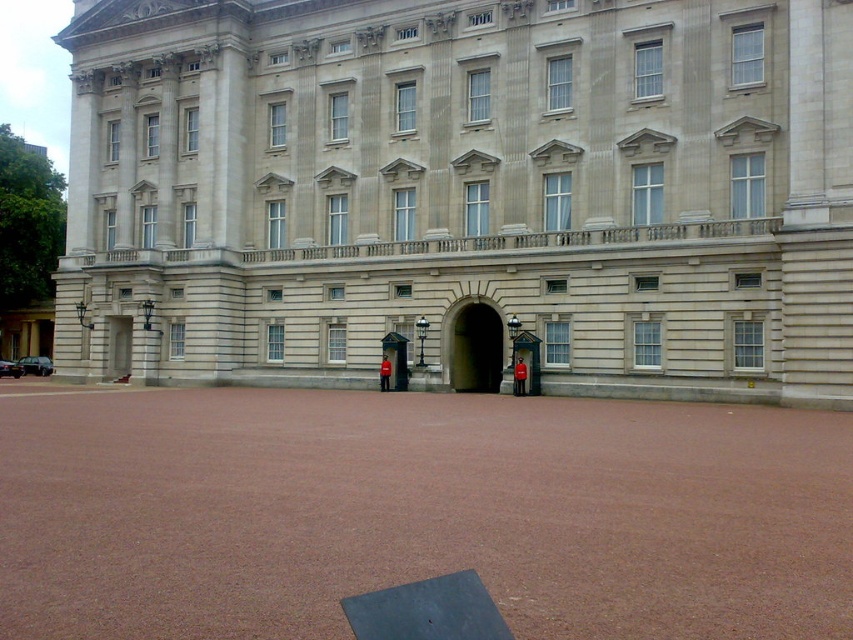
You are a visitor approaching the grand classical building. You see the smooth stone archway at center and the red uniform at center. How far apart are these two objects from each other?

The smooth stone archway at center and the red uniform at center are 10.39 feet apart.

You are a tour guide explaining the building to visitors. You mention the smooth stone door at left and the red uniformed guard at center. Which object is larger?

The smooth stone door at left is bigger than the red uniformed guard at center.

From the picture: You are standing at the entrance of the grand classical building and want to move towards the point labeled point (476, 326). However, there is an obstacle at point (404, 378). Can you reach your destination without passing through the obstacle?

Since point (476, 326) is behind point (404, 378), you can reach point (476, 326) without passing through the obstacle at point (404, 378) by moving around it.